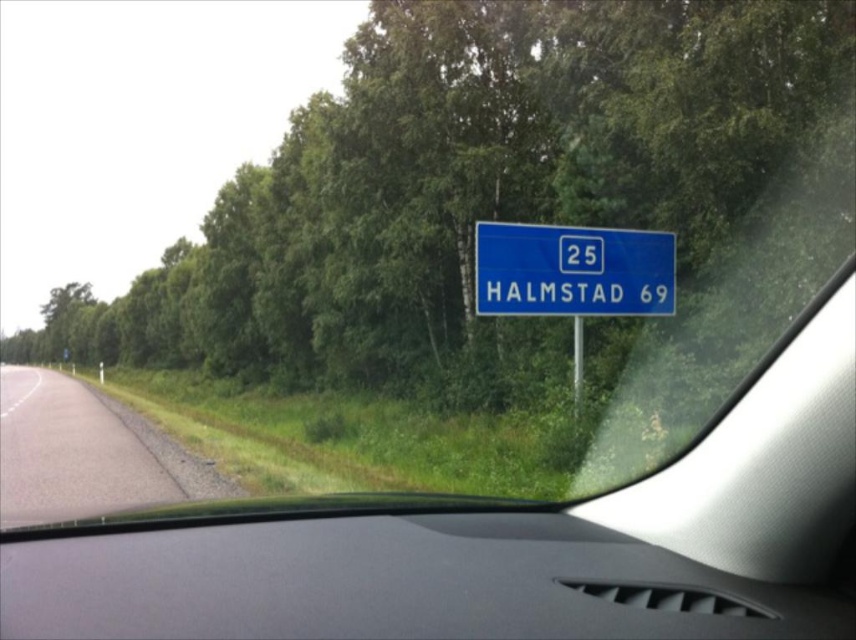
Question: Can you confirm if black matte dashboard at center is positioned to the right of blue plastic sign at center?

Choices:
 (A) no
 (B) yes

Answer: (A)

Question: Among these points, which one is farthest from the camera?

Choices:
 (A) (152, 484)
 (B) (254, 525)
 (C) (575, 284)

Answer: (A)

Question: Which point is farther to the camera?

Choices:
 (A) (578, 294)
 (B) (117, 564)
 (C) (52, 456)

Answer: (C)

Question: Can you confirm if black matte dashboard at center is bigger than gray asphalt road at lower left?

Choices:
 (A) no
 (B) yes

Answer: (A)

Question: Which object is positioned farthest from the blue plastic sign at center?

Choices:
 (A) gray asphalt road at lower left
 (B) black matte dashboard at center

Answer: (A)

Question: Does gray asphalt road at lower left come behind blue plastic sign at center?

Choices:
 (A) yes
 (B) no

Answer: (B)